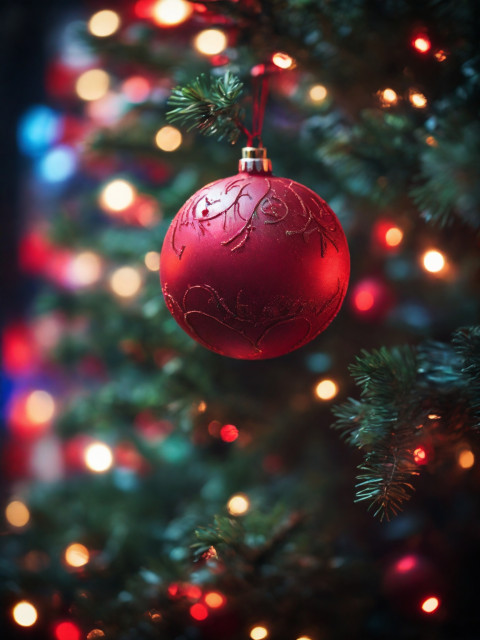
This screenshot has height=640, width=480. Find the location of `red ornament`. red ornament is located at coordinates (281, 269).